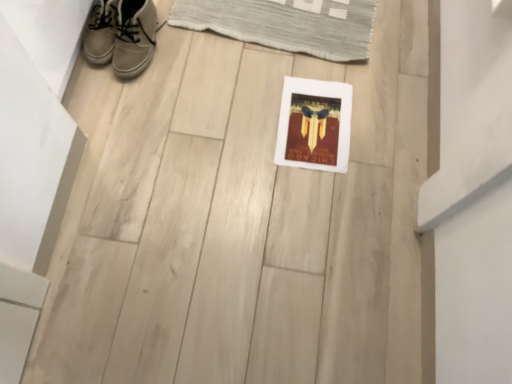
Question: Does white matte picture frame at center turn towards leather sneaker at upper left, the 2th footwear in the right-to-left sequence?

Choices:
 (A) no
 (B) yes

Answer: (A)

Question: Is white matte picture frame at center bigger than leather sneaker at upper left, the 2th footwear in the right-to-left sequence?

Choices:
 (A) yes
 (B) no

Answer: (B)

Question: Is white matte picture frame at center oriented away from leather sneaker at upper left, arranged as the first footwear when viewed from the left?

Choices:
 (A) yes
 (B) no

Answer: (B)

Question: Does white matte picture frame at center have a lesser width compared to leather sneaker at upper left, the 2th footwear in the right-to-left sequence?

Choices:
 (A) no
 (B) yes

Answer: (A)

Question: Considering the relative sizes of white matte picture frame at center and leather sneaker at upper left, arranged as the first footwear when viewed from the left, in the image provided, is white matte picture frame at center shorter than leather sneaker at upper left, arranged as the first footwear when viewed from the left,?

Choices:
 (A) yes
 (B) no

Answer: (A)

Question: From their relative heights in the image, would you say white matte picture frame at center is taller or shorter than white leather sneakers at upper left, the first footwear in the right-to-left sequence?

Choices:
 (A) short
 (B) tall

Answer: (A)

Question: Visually, is white matte picture frame at center positioned to the left or to the right of white leather sneakers at upper left, which is the 2th footwear from left to right?

Choices:
 (A) left
 (B) right

Answer: (B)

Question: Would you say white matte picture frame at center is inside or outside white leather sneakers at upper left, the first footwear in the right-to-left sequence?

Choices:
 (A) inside
 (B) outside

Answer: (B)

Question: Considering their positions, is white matte picture frame at center located in front of or behind white leather sneakers at upper left, the first footwear in the right-to-left sequence?

Choices:
 (A) behind
 (B) front

Answer: (A)

Question: Based on their sizes in the image, would you say white leather sneakers at upper left, which is the 2th footwear from left to right, is bigger or smaller than leather sneaker at upper left, the 2th footwear in the right-to-left sequence?

Choices:
 (A) small
 (B) big

Answer: (B)

Question: Is white leather sneakers at upper left, the first footwear in the right-to-left sequence, inside or outside of leather sneaker at upper left, arranged as the first footwear when viewed from the left?

Choices:
 (A) outside
 (B) inside

Answer: (A)

Question: Visually, is white leather sneakers at upper left, which is the 2th footwear from left to right, positioned to the left or to the right of leather sneaker at upper left, the 2th footwear in the right-to-left sequence?

Choices:
 (A) left
 (B) right

Answer: (B)

Question: Looking at their shapes, would you say white leather sneakers at upper left, the first footwear in the right-to-left sequence, is wider or thinner than leather sneaker at upper left, arranged as the first footwear when viewed from the left?

Choices:
 (A) thin
 (B) wide

Answer: (B)

Question: Considering the positions of point (102, 18) and point (95, 56), is point (102, 18) closer or farther from the camera than point (95, 56)?

Choices:
 (A) closer
 (B) farther

Answer: (A)

Question: Would you say leather sneaker at upper left, arranged as the first footwear when viewed from the left, is to the left or to the right of white leather sneakers at upper left, the first footwear in the right-to-left sequence, in the picture?

Choices:
 (A) left
 (B) right

Answer: (A)